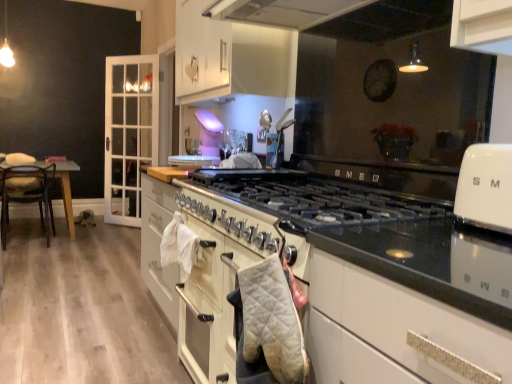
Question: Which direction should I rotate to look at white glossy cabinet at upper center, the second cabinetry viewed from the left?

Choices:
 (A) right
 (B) left

Answer: (B)

Question: Is white glossy cabinet at left, the 2th cabinetry from the right, positioned in front of white quilted oven mitt at center?

Choices:
 (A) no
 (B) yes

Answer: (A)

Question: From the image's perspective, is white glossy cabinet at left, the 2th cabinetry from the right, located beneath white quilted oven mitt at center?

Choices:
 (A) no
 (B) yes

Answer: (A)

Question: Considering the relative sizes of white glossy cabinet at left, which is counted as the 1th cabinetry, starting from the left, and white quilted oven mitt at center in the image provided, is white glossy cabinet at left, which is counted as the 1th cabinetry, starting from the left, shorter than white quilted oven mitt at center?

Choices:
 (A) no
 (B) yes

Answer: (A)

Question: Considering the relative positions of white glossy cabinet at left, which is counted as the 2th cabinetry, starting from the front, and white quilted oven mitt at center in the image provided, is white glossy cabinet at left, which is counted as the 2th cabinetry, starting from the front, to the right of white quilted oven mitt at center from the viewer's perspective?

Choices:
 (A) no
 (B) yes

Answer: (A)

Question: Is white quilted oven mitt at center at the back of white glossy cabinet at left, marked as the first cabinetry in a back-to-front arrangement?

Choices:
 (A) no
 (B) yes

Answer: (A)

Question: Is white glossy cabinet at left, the 2th cabinetry from the right, to the left of white quilted oven mitt at center from the viewer's perspective?

Choices:
 (A) no
 (B) yes

Answer: (B)

Question: Does white glossy cabinet at upper center, which is counted as the first cabinetry, starting from the right, appear on the right side of white quilted oven mitt at center?

Choices:
 (A) yes
 (B) no

Answer: (B)

Question: Considering the relative sizes of white glossy cabinet at upper center, which is counted as the first cabinetry, starting from the right, and white quilted oven mitt at center in the image provided, is white glossy cabinet at upper center, which is counted as the first cabinetry, starting from the right, smaller than white quilted oven mitt at center?

Choices:
 (A) no
 (B) yes

Answer: (A)

Question: Is white glossy cabinet at upper center, which is counted as the first cabinetry, starting from the right, facing towards white quilted oven mitt at center?

Choices:
 (A) yes
 (B) no

Answer: (B)

Question: Is white glossy cabinet at upper center, the second cabinetry in the back-to-front sequence, far away from white quilted oven mitt at center?

Choices:
 (A) no
 (B) yes

Answer: (B)

Question: From a real-world perspective, is white glossy cabinet at upper center, the second cabinetry viewed from the left, over white quilted oven mitt at center?

Choices:
 (A) yes
 (B) no

Answer: (A)

Question: Considering the relative positions of white glossy cabinet at upper center, the second cabinetry in the back-to-front sequence, and white quilted oven mitt at center in the image provided, is white glossy cabinet at upper center, the second cabinetry in the back-to-front sequence, to the left of white quilted oven mitt at center from the viewer's perspective?

Choices:
 (A) yes
 (B) no

Answer: (A)

Question: Is white glossy oven at upper right surrounded by white quilted oven mitt at center?

Choices:
 (A) yes
 (B) no

Answer: (B)